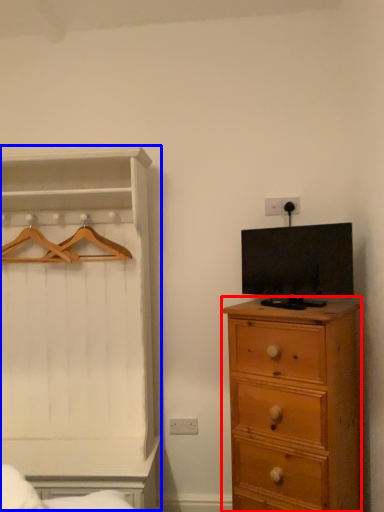
Question: Among these objects, which one is nearest to the camera, chest of drawers (highlighted by a red box) or dresser (highlighted by a blue box)?

Choices:
 (A) chest of drawers
 (B) dresser

Answer: (A)